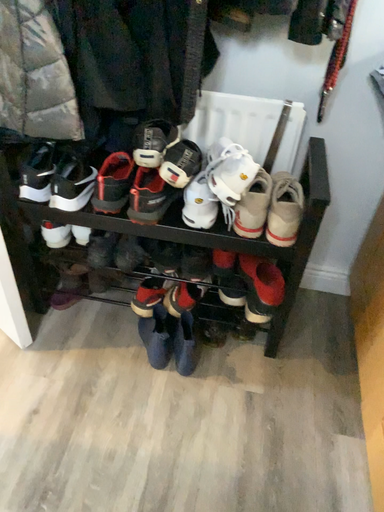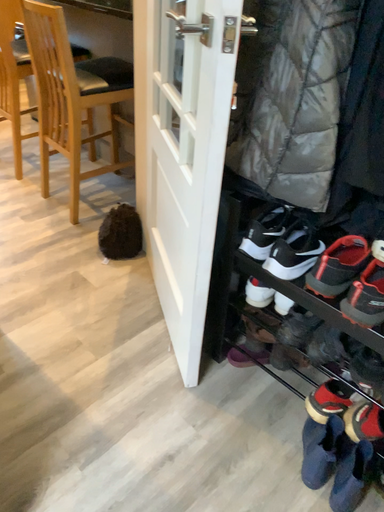
Question: Which way did the camera rotate in the video?

Choices:
 (A) rotated downward
 (B) rotated upward

Answer: (B)